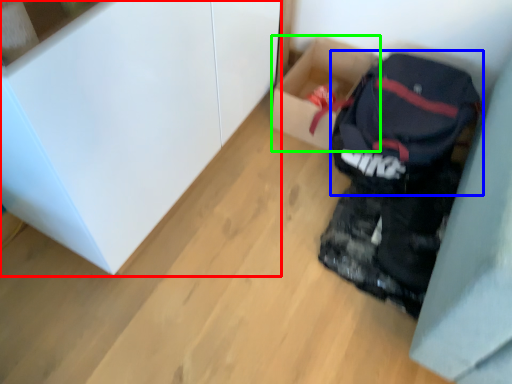
Question: Which object is positioned farthest from cabinetry (highlighted by a red box)? Select from backpack (highlighted by a blue box) and box (highlighted by a green box).

Choices:
 (A) backpack
 (B) box

Answer: (A)